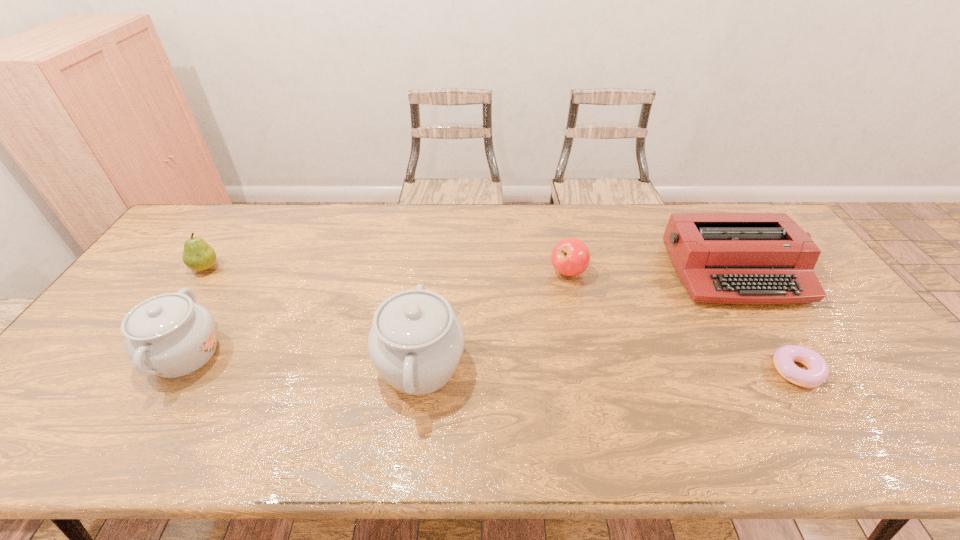
Identify which object is the second nearest to the typewriter. Please provide its 2D coordinates. Your answer should be formatted as a tuple, i.e. [(x, y)], where the tuple contains the x and y coordinates of a point satisfying the conditions above.

[(570, 257)]

Identify which object is the second nearest to the doughnut. Please provide its 2D coordinates. Your answer should be formatted as a tuple, i.e. [(x, y)], where the tuple contains the x and y coordinates of a point satisfying the conditions above.

[(570, 257)]